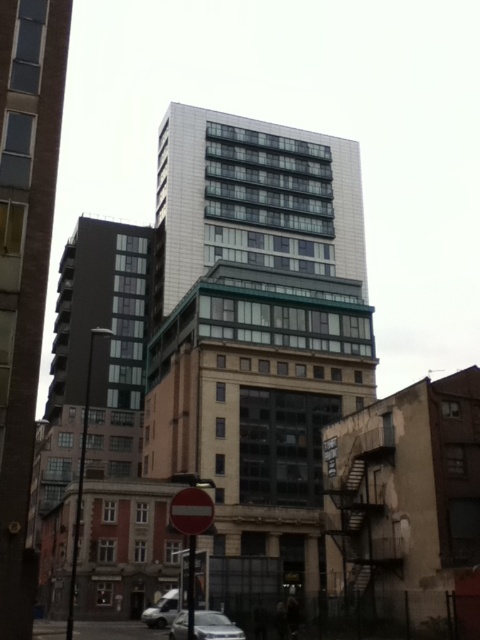
Who is higher up, red plastic sign at lower center or silver metallic car at lower center?

red plastic sign at lower center is higher up.

Does red plastic sign at lower center appear under silver metallic car at lower center?

No, red plastic sign at lower center is not below silver metallic car at lower center.

This screenshot has width=480, height=640. What do you see at coordinates (191, 532) in the screenshot? I see `red plastic sign at lower center` at bounding box center [191, 532].

This screenshot has width=480, height=640. Identify the location of red plastic sign at lower center. (191, 532).

Who is more distant from viewer, [21,115] or [175,525]?

The point [21,115] is more distant.

Between matte glass building at center and red matte stop sign at center, which one has less height?

Standing shorter between the two is red matte stop sign at center.

Is point (40, 19) positioned in front of point (180, 506)?

No.

I want to click on matte glass building at center, so click(24, 268).

In the scene shown: Can you confirm if matte glass building at center is bigger than silver metallic car at lower center?

Yes, matte glass building at center is bigger than silver metallic car at lower center.

Does matte glass building at center appear on the left side of silver metallic car at lower center?

Indeed, matte glass building at center is positioned on the left side of silver metallic car at lower center.

Describe the element at coordinates (24, 268) in the screenshot. The height and width of the screenshot is (640, 480). I see `matte glass building at center` at that location.

You are a GUI agent. You are given a task and a screenshot of the screen. Output one action in this format:
    pyautogui.click(x=<x>, y=<y>)
    Task: Click on the matte glass building at center
    Image resolution: width=480 pixels, height=640 pixels.
    Given the screenshot: What is the action you would take?
    pyautogui.click(x=24, y=268)